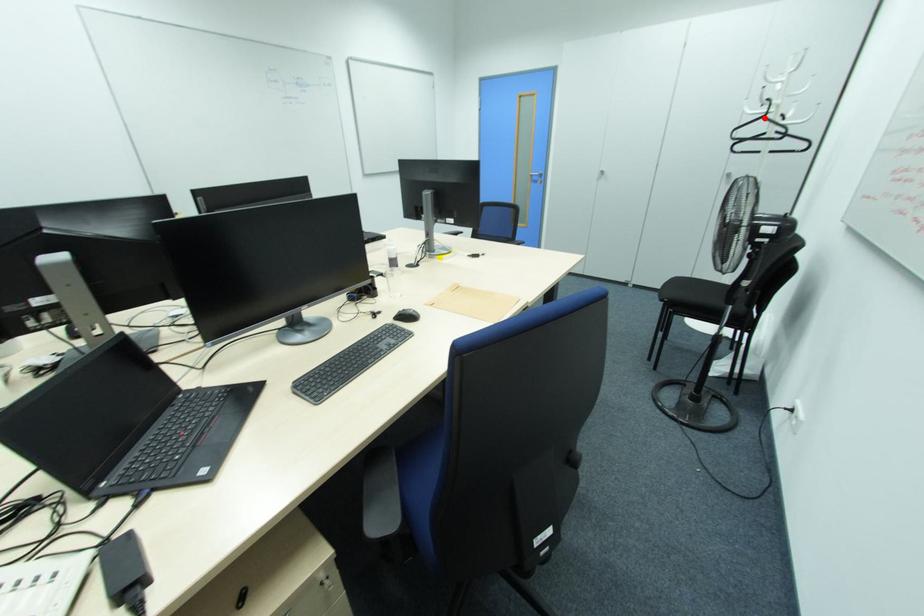
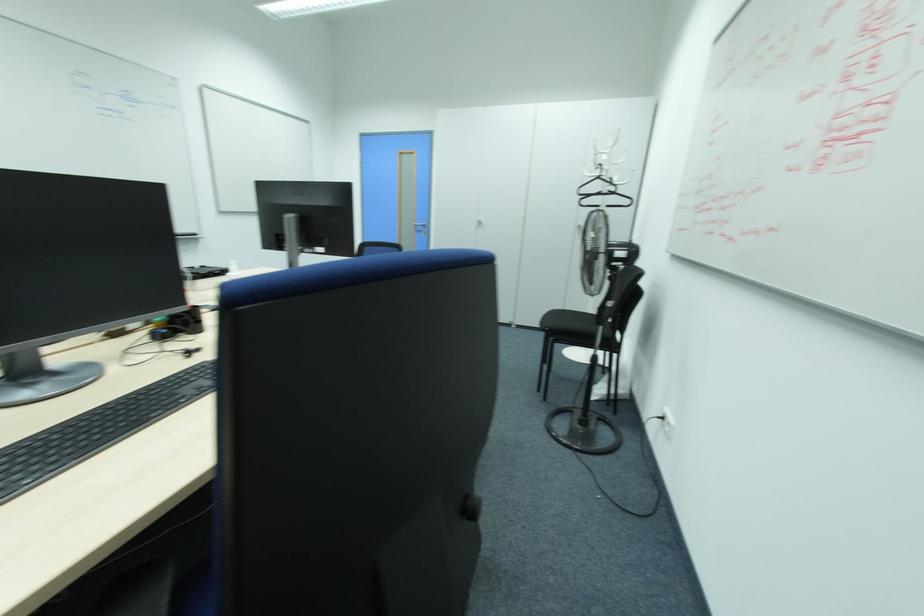
Question: I am providing you with two images of the same scene from different viewpoints. Image1 has a red point marked. In image2, the corresponding 3D location appears at what relative position? Reply with the corresponding letter.

Choices:
 (A) Closer
 (B) Farther

Answer: (A)